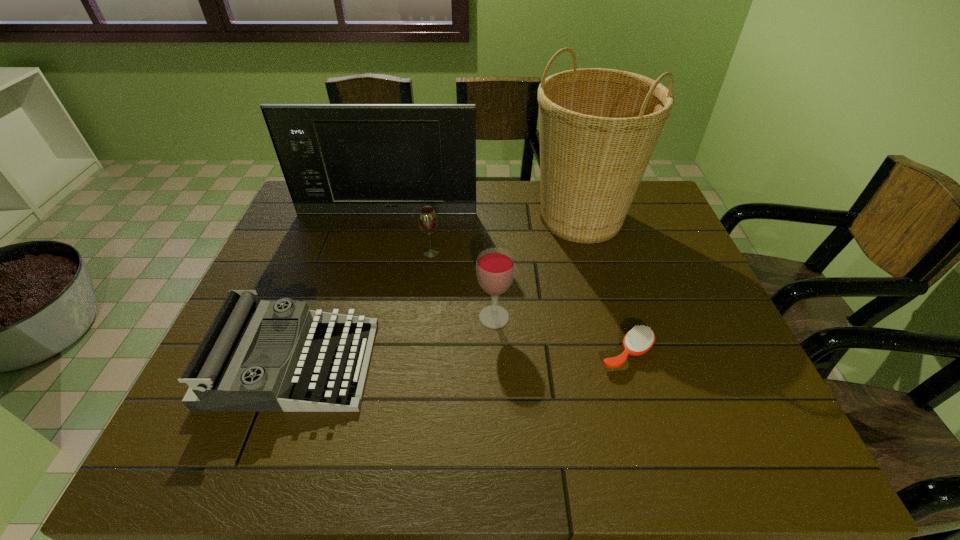
Locate an element on the screen. object that is at the far right corner is located at coordinates (598, 128).

The image size is (960, 540). In order to click on vacant space at the far edge of the desktop in this screenshot , I will do `click(535, 192)`.

Image resolution: width=960 pixels, height=540 pixels. Find the location of `free space at the near edge`. free space at the near edge is located at coordinates 528,442.

Where is `vacant space at the left edge of the desktop`? vacant space at the left edge of the desktop is located at coordinates (290, 264).

In the image, there is a desktop. At what (x,y) coordinates should I click in order to perform the action: click on blank space at the right edge. Please return your answer as a coordinate pair (x, y). This screenshot has height=540, width=960. Looking at the image, I should click on (679, 322).

In the image, there is a desktop. What are the coordinates of `vacant area at the near right corner` in the screenshot? It's located at (782, 455).

What are the coordinates of `vacant point located between the third tallest object and the shortest object` in the screenshot? It's located at point(561,335).

Identify the location of vacant space that is in between the typewriter and the basket. (437, 291).

This screenshot has height=540, width=960. Find the location of `vacant area between the taller wineglass and the hairbrush`. vacant area between the taller wineglass and the hairbrush is located at coordinates (561, 335).

Where is `empty space between the third tallest object and the typewriter`? This screenshot has width=960, height=540. empty space between the third tallest object and the typewriter is located at coordinates (x=394, y=340).